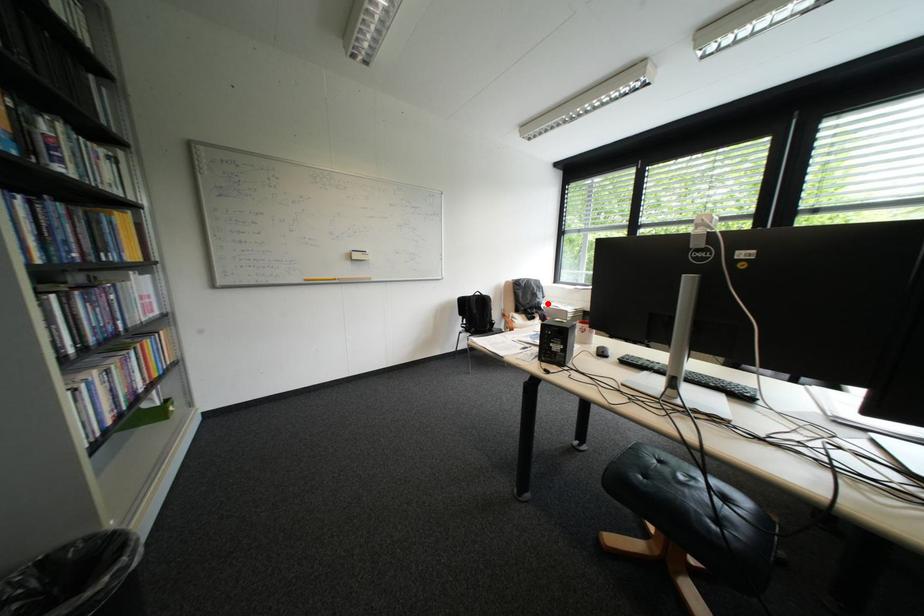
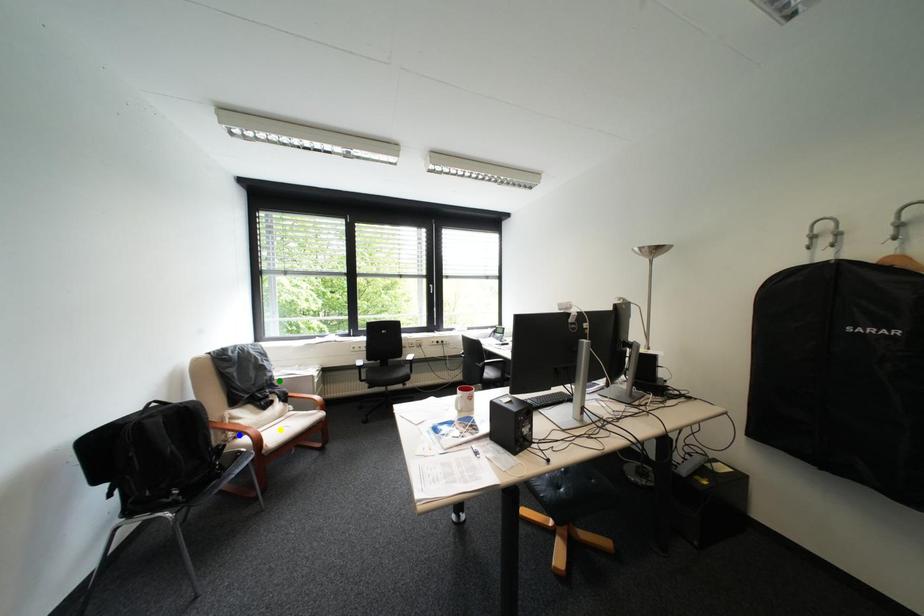
Question: I am providing you with two images of the same scene from different viewpoints. A red point is marked on the first image. You are given multiple points on the second image. Which spot in image 2 lines up with the point in image 1?

Choices:
 (A) blue point
 (B) yellow point
 (C) green point

Answer: (C)